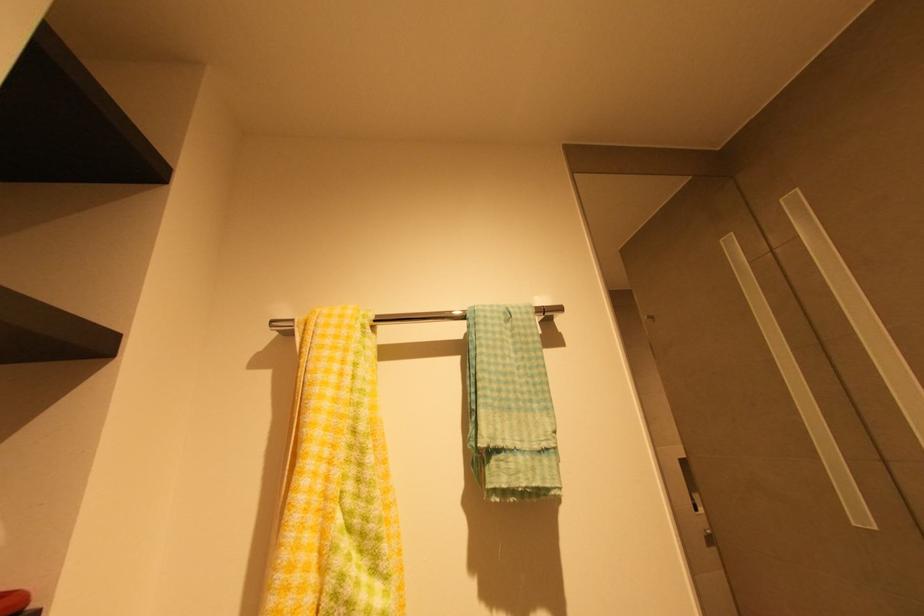
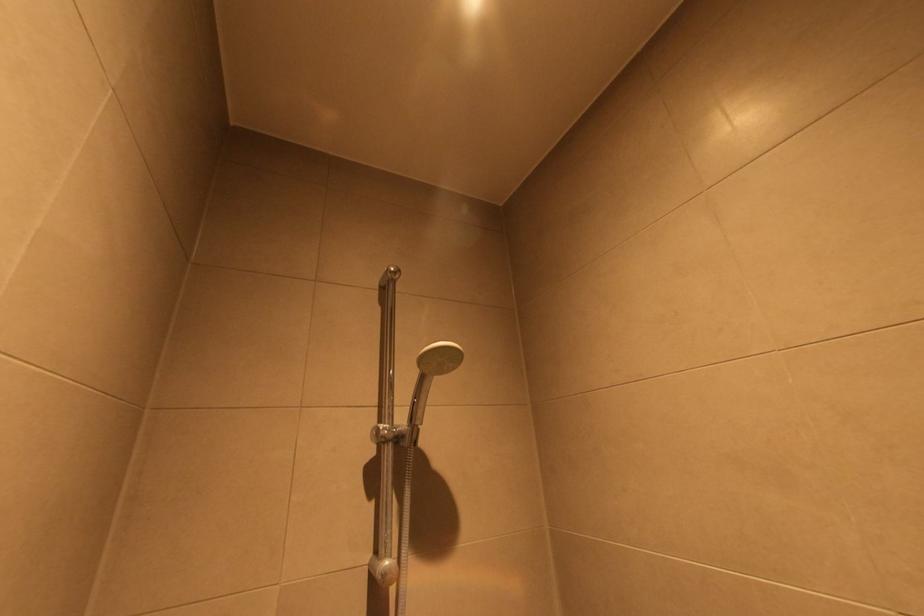
Question: In a continuous first-person perspective shot, in which direction is the camera moving?

Choices:
 (A) Left
 (B) Right
 (C) Forward
 (D) Backward

Answer: (B)